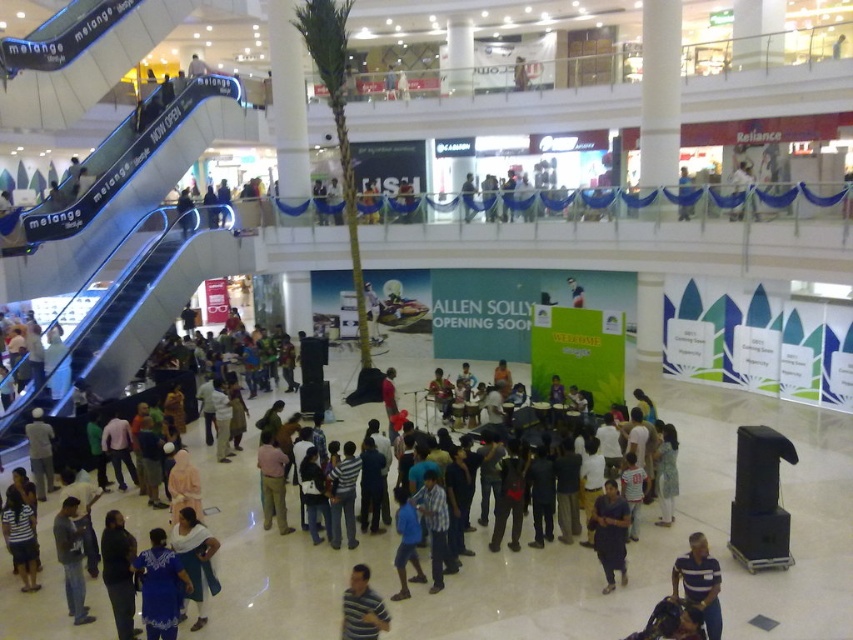
Question: Is dark gray shirt at lower left further to the viewer compared to striped shirt at center?

Choices:
 (A) no
 (B) yes

Answer: (B)

Question: Is striped shirt at center positioned before blue fabric umbrella at center?

Choices:
 (A) yes
 (B) no

Answer: (A)

Question: Is dark blue shirt at center below dark gray sweater at lower left?

Choices:
 (A) no
 (B) yes

Answer: (A)

Question: Which object is closer to the camera taking this photo?

Choices:
 (A) blue fabric umbrella at center
 (B) striped polo shirt at lower right

Answer: (B)

Question: Which of the following is the farthest from the observer?

Choices:
 (A) 57,552
 (B) 703,561
 (C) 608,528

Answer: (A)

Question: Which is nearer to the dark blue shirt at center?

Choices:
 (A) dark gray sweater at lower left
 (B) striped polo shirt at lower right
 (C) white fabric at upper center

Answer: (B)